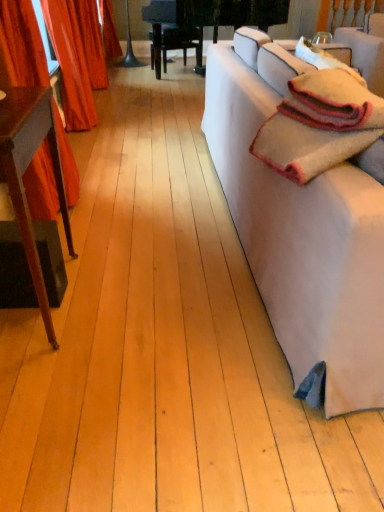
The image size is (384, 512). What are the coordinates of `free space in front of mahogany wood table at left` in the screenshot? It's located at (52, 392).